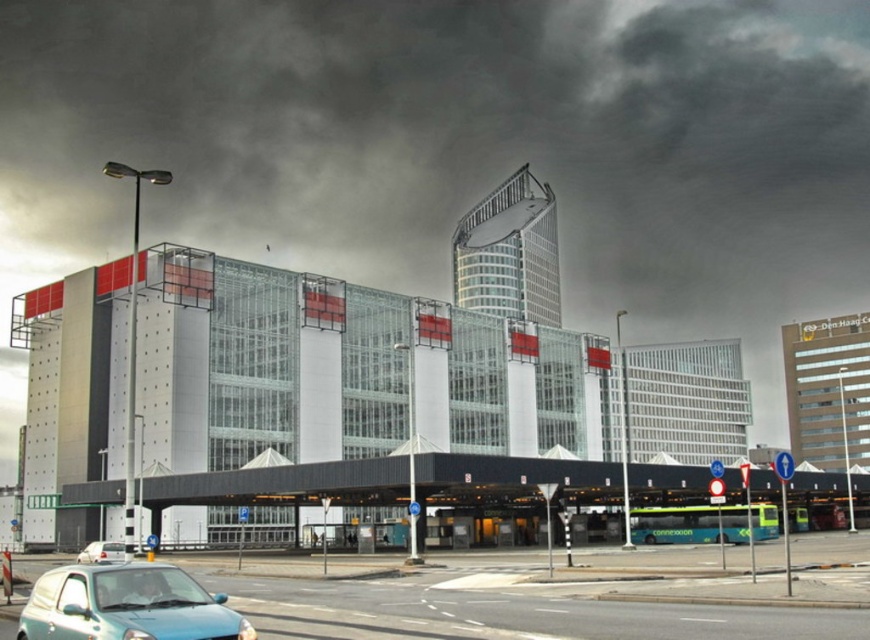
You are a delivery driver trying to park your truck between the teal matte car at lower left and the white matte van at lower left. The truck requires 2.5 meters of space. Can you fit your truck in the available space between them?

The teal matte car at lower left might be wider than the white matte van at lower left, so the space between them may not be sufficient for the truck requiring 2.5 meters. It is uncertain if there is enough space without knowing their exact widths.

You are standing at the intersection and want to walk to both points marked on the building. Which point, point (70,620) or point (111,561), is closer to you?

Point (70,620) is closer to the viewer than point (111,561).

You are standing at the center of the scene and want to locate the teal matte car at lower left. According to the coordinates provided, in which direction should you look to find it?

You should look to the lower left direction to find the teal matte car at lower left as it is located at coordinates point (126,605).